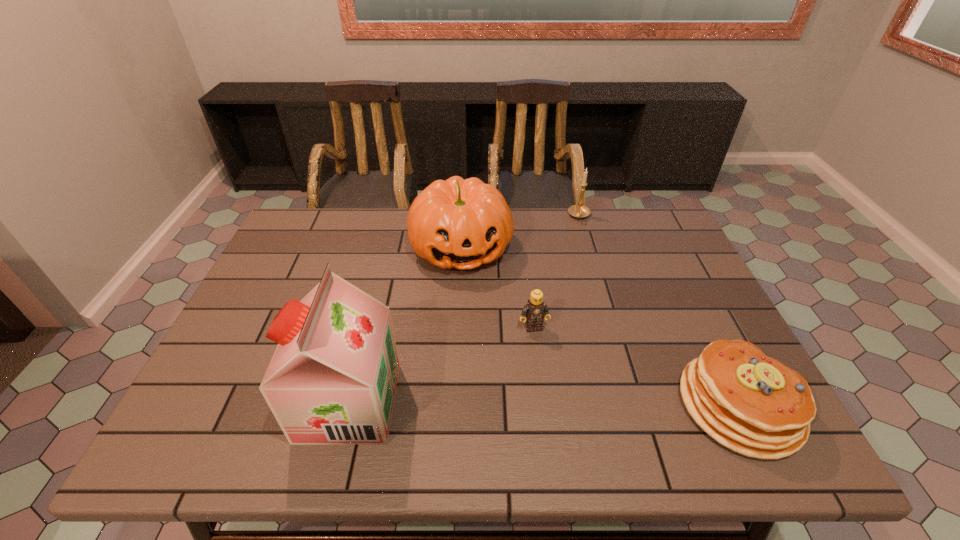
The width and height of the screenshot is (960, 540). I want to click on candle holder at the far edge, so click(x=579, y=211).

Find the location of `soya milk at the near edge`. soya milk at the near edge is located at coordinates point(332,380).

You are a GUI agent. You are given a task and a screenshot of the screen. Output one action in this format:
    pyautogui.click(x=<x>, y=<y>)
    Task: Click on the pancake at the near edge
    The width and height of the screenshot is (960, 540).
    Given the screenshot: What is the action you would take?
    pyautogui.click(x=753, y=404)

Where is `object that is at the right edge`? The image size is (960, 540). object that is at the right edge is located at coordinates (753, 404).

The image size is (960, 540). Find the location of `object situated at the near right corner`. object situated at the near right corner is located at coordinates (753, 404).

Locate an element on the screen. This screenshot has width=960, height=540. vacant space at the far edge is located at coordinates (564, 221).

Locate an element on the screen. The height and width of the screenshot is (540, 960). free space at the near edge is located at coordinates (612, 394).

Locate an element on the screen. Image resolution: width=960 pixels, height=540 pixels. vacant space at the right edge of the desktop is located at coordinates (638, 253).

Where is `vacant space at the far left corner of the desktop`? The height and width of the screenshot is (540, 960). vacant space at the far left corner of the desktop is located at coordinates (292, 218).

Find the location of a particular element. The width and height of the screenshot is (960, 540). vacant space that is in between the rightmost object and the third tallest object is located at coordinates (660, 310).